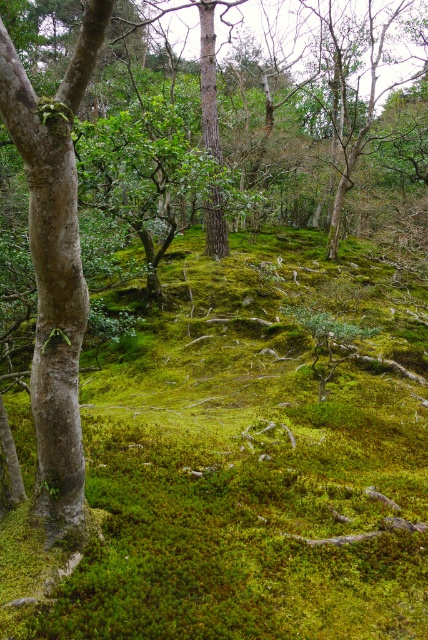
Is green mossy ground at center to the right of smooth brown tree trunk at center from the viewer's perspective?

Yes, green mossy ground at center is to the right of smooth brown tree trunk at center.

The width and height of the screenshot is (428, 640). Find the location of `green mossy ground at center`. green mossy ground at center is located at coordinates (247, 467).